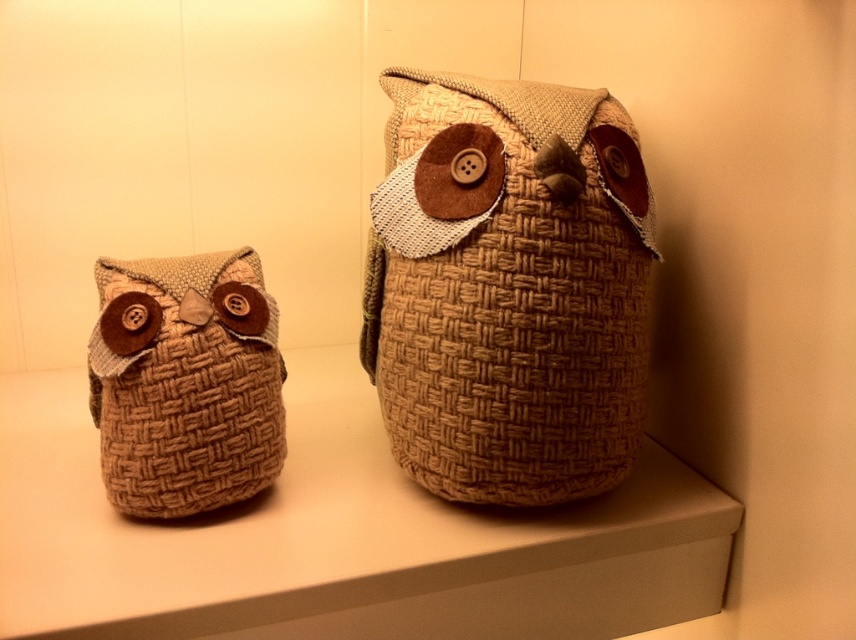
You are an interior designer arranging items on a shelf. You have a woven fabric shelf at center and a woven fabric owl at center. Which object is taller?

The woven fabric owl at center is taller than the woven fabric shelf at center.

You are organizing a display and need to know which owl takes up more space. Based on the image, which of the two woven fabric owls, the woven fabric owl at center or the woven fabric owl at left, is bigger?

The woven fabric owl at center is larger in size compared to the woven fabric owl at left, so it takes up more space.

You have a small decorative item that is 10 cm wide. You want to place it on the woven fabric shelf at center without overlapping the woven fabric owl at left. Is there enough space on the shelf?

The woven fabric shelf at center is wider than the woven fabric owl at left, so there should be enough space to place the 10 cm wide decorative item without overlapping the owl.